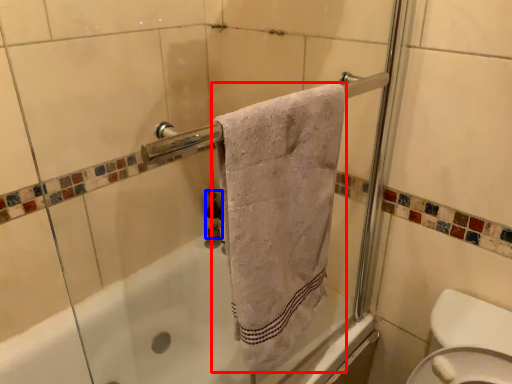
Question: Which object is further to the camera taking this photo, towel (highlighted by a red box) or toiletry (highlighted by a blue box)?

Choices:
 (A) towel
 (B) toiletry

Answer: (B)